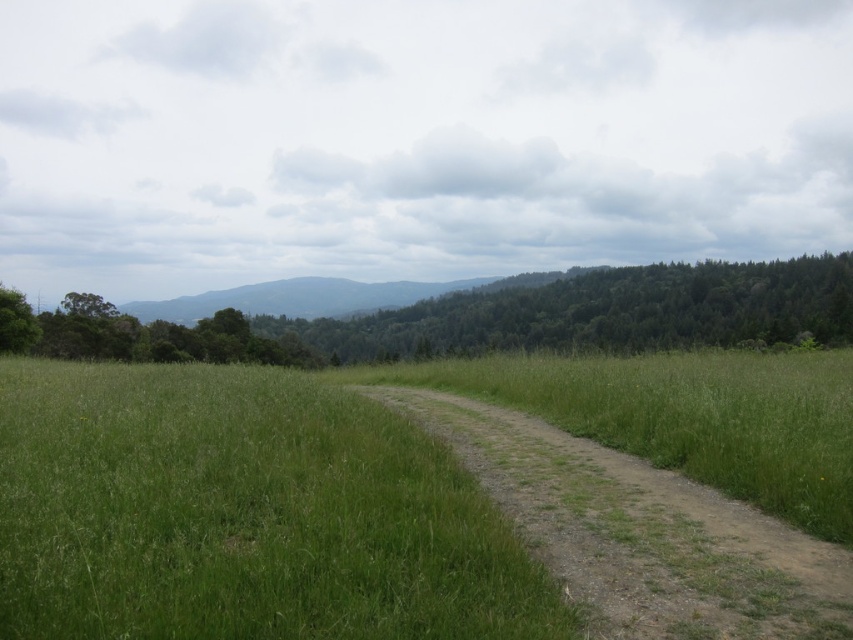
Question: Is dirt/gravel path at center to the right of green leafy trees at upper center from the viewer's perspective?

Choices:
 (A) yes
 (B) no

Answer: (A)

Question: Can you confirm if dirt/gravel path at center is smaller than green leafy trees at upper center?

Choices:
 (A) no
 (B) yes

Answer: (B)

Question: Which of the following is the closest to the observer?

Choices:
 (A) green leafy trees at upper center
 (B) dirt/gravel path at center

Answer: (B)

Question: Does dirt/gravel path at center appear over green leafy trees at upper center?

Choices:
 (A) yes
 (B) no

Answer: (B)

Question: Which of the following is the farthest from the observer?

Choices:
 (A) green leafy trees at upper center
 (B) dirt/gravel path at center

Answer: (A)